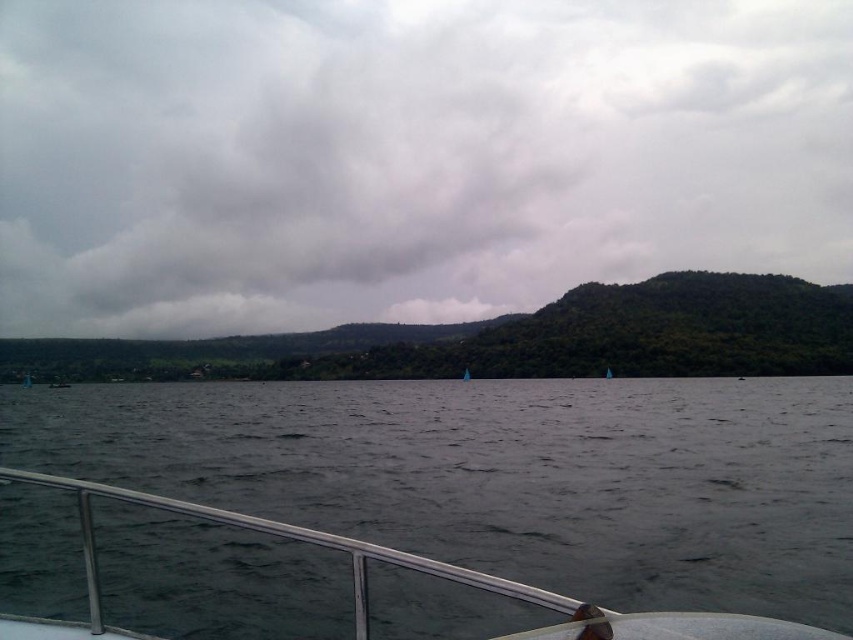
Question: Which point is closer to the camera?

Choices:
 (A) (706, 436)
 (B) (169, 1)

Answer: (A)

Question: Is cloudy sky at upper center wider than dark gray water at center?

Choices:
 (A) yes
 (B) no

Answer: (A)

Question: Which object appears closest to the camera in this image?

Choices:
 (A) cloudy sky at upper center
 (B) dark gray water at center

Answer: (B)

Question: Does cloudy sky at upper center have a greater width compared to dark gray water at center?

Choices:
 (A) yes
 (B) no

Answer: (A)

Question: Is cloudy sky at upper center thinner than dark gray water at center?

Choices:
 (A) no
 (B) yes

Answer: (A)